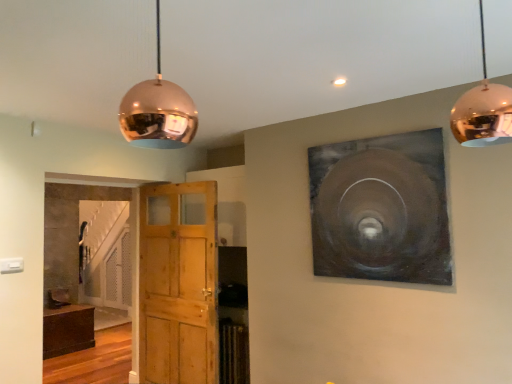
Find the location of a particular element. This screenshot has height=384, width=512. wooden door at center is located at coordinates (178, 283).

The height and width of the screenshot is (384, 512). Identify the location of metallic silver painting at upper right. (381, 209).

The height and width of the screenshot is (384, 512). What are the coordinates of `copper reflective sphere at upper left, the second lamp viewed from the right` in the screenshot? It's located at (158, 111).

Identify the location of dark wood cabinet at lower left. (67, 330).

Is copper reflective sphere at upper right, which is the first lamp in right-to-left order, located outside wooden door at center?

Yes.

Is copper reflective sphere at upper right, which is the first lamp in right-to-left order, directly adjacent to wooden door at center?

No.

From the picture: Does copper reflective sphere at upper right, which is the first lamp in right-to-left order, have a greater height compared to wooden door at center?

No, copper reflective sphere at upper right, which is the first lamp in right-to-left order, is not taller than wooden door at center.

Do you think wooden door at center is within metallic silver painting at upper right, or outside of it?

wooden door at center is outside metallic silver painting at upper right.

Considering the sizes of wooden door at center and metallic silver painting at upper right in the image, is wooden door at center wider or thinner than metallic silver painting at upper right?

Clearly, wooden door at center has more width compared to metallic silver painting at upper right.

From the image's perspective, is wooden door at center under metallic silver painting at upper right?

Result: Yes, from the image's perspective, wooden door at center is beneath metallic silver painting at upper right.

Considering the sizes of objects wooden door at center and copper reflective sphere at upper left, the first lamp viewed from the left, in the image provided, who is shorter, wooden door at center or copper reflective sphere at upper left, the first lamp viewed from the left,?

copper reflective sphere at upper left, the first lamp viewed from the left.

From the image's perspective, which one is positioned higher, wooden door at center or copper reflective sphere at upper left, the second lamp viewed from the right?

copper reflective sphere at upper left, the second lamp viewed from the right, from the image's perspective.

What's the angular difference between wooden door at center and copper reflective sphere at upper left, the second lamp viewed from the right,'s facing directions?

There is a 178-degree angle between the facing directions of wooden door at center and copper reflective sphere at upper left, the second lamp viewed from the right.

Based on their positions, is wooden door at center located to the left or right of copper reflective sphere at upper left, the first lamp viewed from the left?

From the image, it's evident that wooden door at center is to the left of copper reflective sphere at upper left, the first lamp viewed from the left.

Consider the image. Does copper reflective sphere at upper left, the first lamp viewed from the left, have a greater height compared to wooden door at center?

Incorrect, the height of copper reflective sphere at upper left, the first lamp viewed from the left, is not larger of that of wooden door at center.

Is copper reflective sphere at upper left, the first lamp viewed from the left, positioned with its back to wooden door at center?

No, copper reflective sphere at upper left, the first lamp viewed from the left,'s orientation is not away from wooden door at center.

Is copper reflective sphere at upper left, the second lamp viewed from the right, next to wooden door at center and touching it?

No, copper reflective sphere at upper left, the second lamp viewed from the right, is not in contact with wooden door at center.

Considering the relative positions of copper reflective sphere at upper left, the first lamp viewed from the left, and wooden door at center in the image provided, is copper reflective sphere at upper left, the first lamp viewed from the left, to the left of wooden door at center from the viewer's perspective?

In fact, copper reflective sphere at upper left, the first lamp viewed from the left, is to the right of wooden door at center.

Does copper reflective sphere at upper right, which is the first lamp in right-to-left order, touch dark wood cabinet at lower left?

No.

Locate an element on the screen. cabinetry below the copper reflective sphere at upper right, the 2th lamp in the left-to-right sequence (from a real-world perspective) is located at coordinates (67, 330).

Is copper reflective sphere at upper right, the 2th lamp in the left-to-right sequence, at the right side of dark wood cabinet at lower left?

Yes.

Considering the positions of objects copper reflective sphere at upper right, the 2th lamp in the left-to-right sequence, and dark wood cabinet at lower left in the image provided, who is in front, copper reflective sphere at upper right, the 2th lamp in the left-to-right sequence, or dark wood cabinet at lower left?

copper reflective sphere at upper right, the 2th lamp in the left-to-right sequence, is more forward.

Considering the sizes of objects wooden door at center and copper reflective sphere at upper right, which is the first lamp in right-to-left order, in the image provided, who is thinner, wooden door at center or copper reflective sphere at upper right, which is the first lamp in right-to-left order,?

wooden door at center.

Based on the photo, which of these two, wooden door at center or copper reflective sphere at upper right, which is the first lamp in right-to-left order, stands taller?

With more height is wooden door at center.

Would you say wooden door at center contains copper reflective sphere at upper right, the 2th lamp in the left-to-right sequence?

No, copper reflective sphere at upper right, the 2th lamp in the left-to-right sequence, is located outside of wooden door at center.

From a real-world perspective, who is located higher, wooden door at center or dark wood cabinet at lower left?

wooden door at center is physically above.

Between wooden door at center and dark wood cabinet at lower left, which one has larger width?

dark wood cabinet at lower left is wider.

Considering the positions of points (195, 208) and (70, 311), is point (195, 208) farther from camera compared to point (70, 311)?

No, (195, 208) is closer to viewer.

Locate an element on the screen. door below the copper reflective sphere at upper right, the 2th lamp in the left-to-right sequence (from the image's perspective) is located at coordinates (178, 283).

Find the location of `picture frame on the right of wooden door at center`. picture frame on the right of wooden door at center is located at coordinates (381, 209).

Based on their spatial positions, is dark wood cabinet at lower left or copper reflective sphere at upper left, the first lamp viewed from the left, closer to copper reflective sphere at upper right, the 2th lamp in the left-to-right sequence?

The object closer to copper reflective sphere at upper right, the 2th lamp in the left-to-right sequence, is copper reflective sphere at upper left, the first lamp viewed from the left.

In the scene shown: Looking at the image, which one is located further to dark wood cabinet at lower left, metallic silver painting at upper right or wooden door at center?

metallic silver painting at upper right is positioned further to the anchor dark wood cabinet at lower left.

Based on their spatial positions, is wooden door at center or copper reflective sphere at upper left, the first lamp viewed from the left, further from dark wood cabinet at lower left?

copper reflective sphere at upper left, the first lamp viewed from the left, is positioned further to the anchor dark wood cabinet at lower left.

Considering their positions, is copper reflective sphere at upper right, which is the first lamp in right-to-left order, positioned further to copper reflective sphere at upper left, the first lamp viewed from the left, than dark wood cabinet at lower left?

A: dark wood cabinet at lower left is positioned further to the anchor copper reflective sphere at upper left, the first lamp viewed from the left.

Which object lies nearer to the anchor point dark wood cabinet at lower left, copper reflective sphere at upper left, the second lamp viewed from the right, or copper reflective sphere at upper right, which is the first lamp in right-to-left order?

copper reflective sphere at upper left, the second lamp viewed from the right.

From the image, which object appears to be nearer to copper reflective sphere at upper right, the 2th lamp in the left-to-right sequence, wooden door at center or metallic silver painting at upper right?

Based on the image, metallic silver painting at upper right appears to be nearer to copper reflective sphere at upper right, the 2th lamp in the left-to-right sequence.

Considering their positions, is wooden door at center positioned closer to copper reflective sphere at upper left, the first lamp viewed from the left, than copper reflective sphere at upper right, which is the first lamp in right-to-left order?

copper reflective sphere at upper right, which is the first lamp in right-to-left order.

Based on the photo, which object lies nearer to the anchor point copper reflective sphere at upper right, the 2th lamp in the left-to-right sequence, wooden door at center or copper reflective sphere at upper left, the second lamp viewed from the right?

copper reflective sphere at upper left, the second lamp viewed from the right, is closer to copper reflective sphere at upper right, the 2th lamp in the left-to-right sequence.

You are a GUI agent. You are given a task and a screenshot of the screen. Output one action in this format:
    pyautogui.click(x=<x>, y=<y>)
    Task: Click on the door positioned between copper reflective sphere at upper left, the second lamp viewed from the right, and dark wood cabinet at lower left from near to far
    
    Given the screenshot: What is the action you would take?
    pyautogui.click(x=178, y=283)

This screenshot has height=384, width=512. I want to click on picture frame positioned between copper reflective sphere at upper right, the 2th lamp in the left-to-right sequence, and dark wood cabinet at lower left from near to far, so click(x=381, y=209).

Image resolution: width=512 pixels, height=384 pixels. In order to click on door between copper reflective sphere at upper right, the 2th lamp in the left-to-right sequence, and dark wood cabinet at lower left in the front-back direction in this screenshot , I will do `click(178, 283)`.

The image size is (512, 384). I want to click on lamp positioned between copper reflective sphere at upper left, the first lamp viewed from the left, and wooden door at center from near to far, so tap(483, 110).